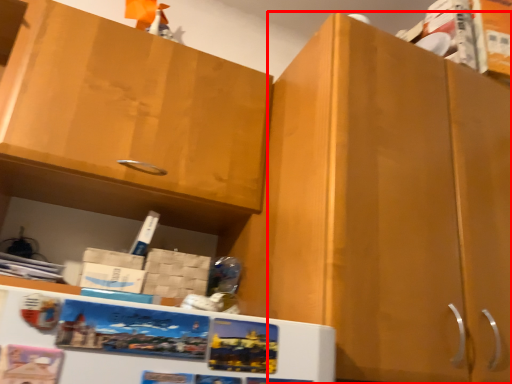
Question: From the image's perspective, where is cabinetry (annotated by the red box) located in relation to cabinetry in the image?

Choices:
 (A) above
 (B) below

Answer: (B)